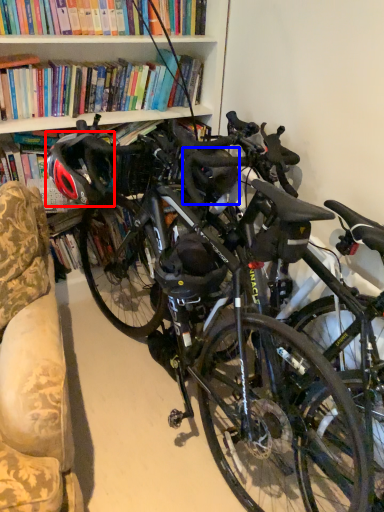
Question: Which of the following is the farthest to the observer, bicycle helmet (highlighted by a red box) or helmet (highlighted by a blue box)?

Choices:
 (A) bicycle helmet
 (B) helmet

Answer: (B)